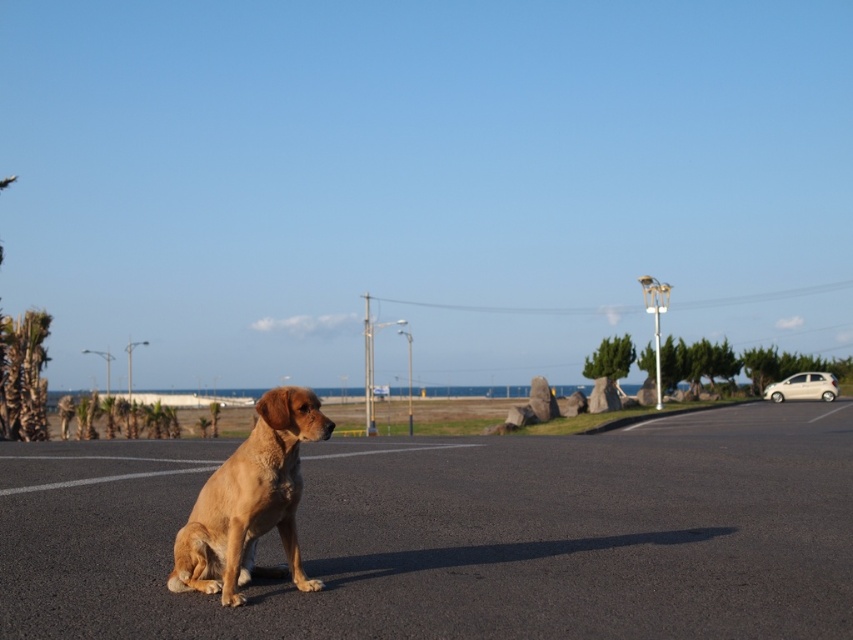
Question: Does golden fur dog at center appear on the right side of beige glossy hatchback at right?

Choices:
 (A) no
 (B) yes

Answer: (A)

Question: Which of the following is the closest to the observer?

Choices:
 (A) (833, 381)
 (B) (10, 378)
 (C) (247, 497)

Answer: (C)

Question: Among these objects, which one is nearest to the camera?

Choices:
 (A) beige glossy hatchback at right
 (B) green leafy palm tree at left
 (C) smooth asphalt parking lot at center
 (D) golden fur dog at center

Answer: (C)

Question: Which point is closer to the camera taking this photo?

Choices:
 (A) (827, 372)
 (B) (18, 396)
 (C) (195, 541)
 (D) (743, 412)

Answer: (C)

Question: Is smooth asphalt parking lot at center to the right of green leafy palm tree at left from the viewer's perspective?

Choices:
 (A) no
 (B) yes

Answer: (B)

Question: Does smooth asphalt parking lot at center appear on the right side of green leafy palm tree at left?

Choices:
 (A) no
 (B) yes

Answer: (B)